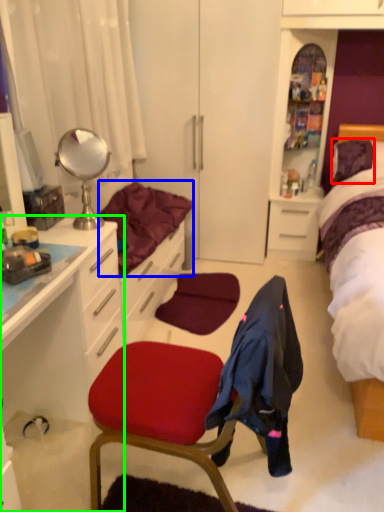
Question: Which object is positioned closest to pillow (highlighted by a red box)? Select from bedding (highlighted by a blue box) and cabinetry (highlighted by a green box).

Choices:
 (A) bedding
 (B) cabinetry

Answer: (A)